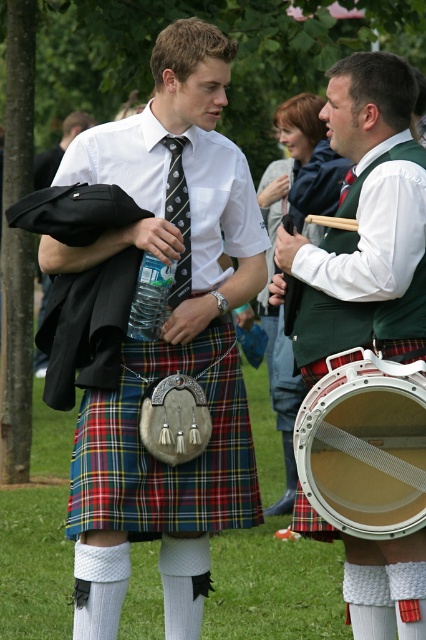
You are designing a costume for a play and need to ensure that the green velvety vest at center and the plaid fabric kilt at center fit within a 1.5 meter wide stage backdrop. Given their widths, will both items fit side by side without overlapping?

The green velvety vest at center is narrower than the plaid fabric kilt at center. However, without knowing the exact widths of both items, it is impossible to determine if their combined width exceeds 1.5 meters. Additional measurements are required to confirm.

Looking at this image, you are an event photographer at the Scottish cultural festival. You need to capture a photo of both the green velvety vest at center and the plaid fabric kilt at center in the same frame. Based on their positions, which object should you focus on first to ensure both are in the frame?

The green velvety vest at center is to the right of the plaid fabric kilt at center. To include both in the frame, focus on the plaid fabric kilt at center first as it is on the left, then adjust the camera to include the green velvety vest at center on the right.

You are attending a Scottish cultural event and notice a green velvety vest at center. Where exactly is this vest positioned in relation to the other elements in the scene?

The green velvety vest at center is located at point coordinates 0.352 on the x and 0.859 on the y axis.